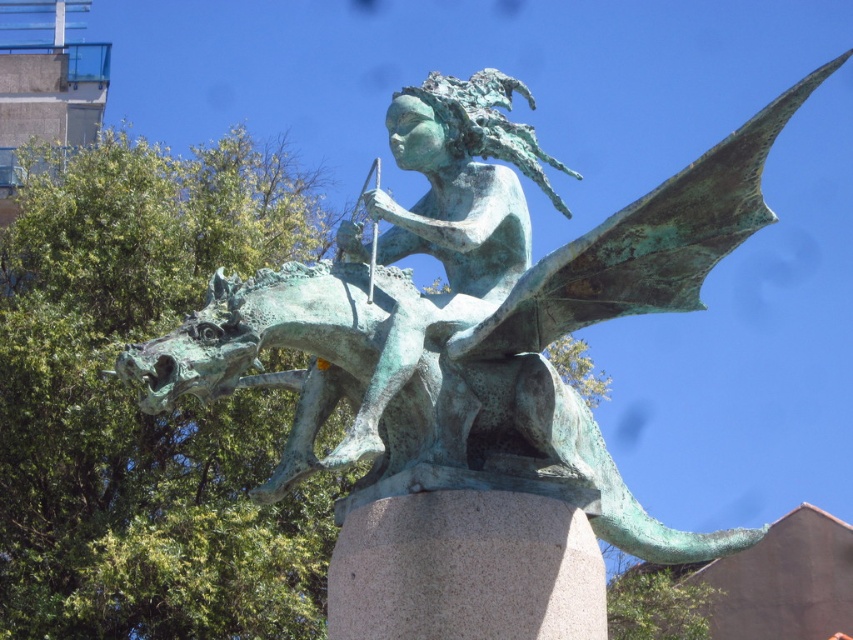
Question: From the image, what is the correct spatial relationship of green patina dragon at center in relation to green patina statue at center?

Choices:
 (A) above
 (B) below

Answer: (A)

Question: Which object appears farthest from the camera in this image?

Choices:
 (A) green patina statue at center
 (B) green patina dragon at center

Answer: (A)

Question: Where is green patina dragon at center located in relation to green patina statue at center in the image?

Choices:
 (A) above
 (B) below

Answer: (A)

Question: Which point is farther from the camera taking this photo?

Choices:
 (A) coord(317,307)
 (B) coord(454,113)

Answer: (B)

Question: Does green patina dragon at center have a larger size compared to green patina statue at center?

Choices:
 (A) no
 (B) yes

Answer: (B)